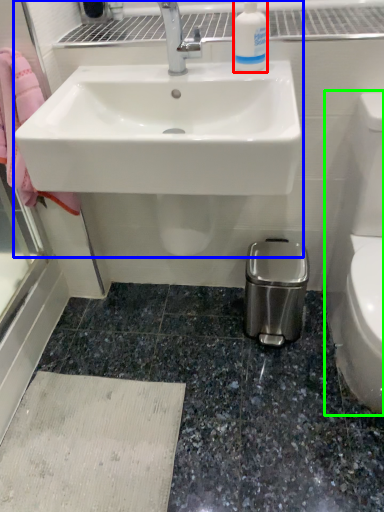
Question: Which object is the closest to the cleaning product (highlighted by a red box)? Choose among these: sink (highlighted by a blue box) or toilet bowl (highlighted by a green box).

Choices:
 (A) sink
 (B) toilet bowl

Answer: (A)